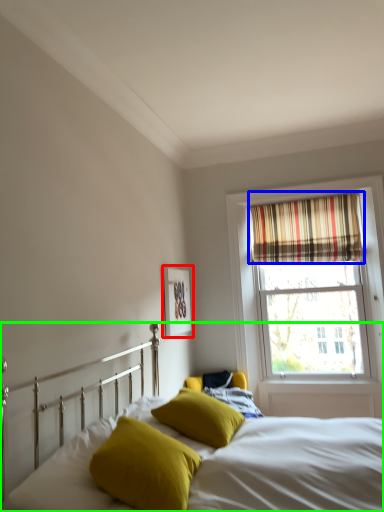
Question: Which is farther away from picture frame (highlighted by a red box)? curtain (highlighted by a blue box) or bed (highlighted by a green box)?

Choices:
 (A) curtain
 (B) bed

Answer: (B)